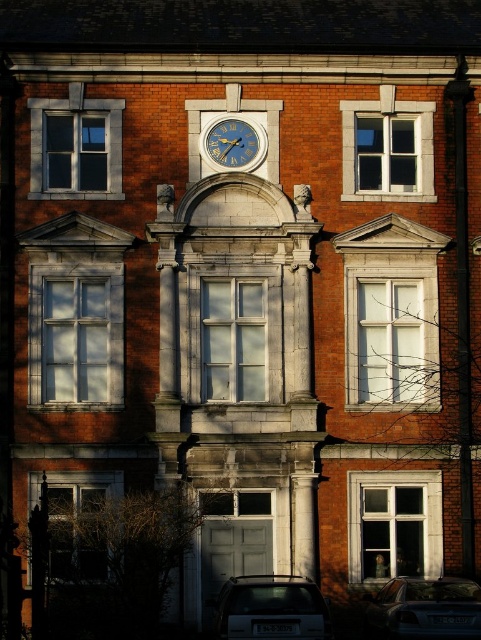
You are a delivery driver approaching the building and need to park your matte silver car at center. The parking spot is directly in front of the white glass window at center. Can you fit your car into the parking spot without overlapping the window?

The white glass window at center is larger in size than the matte silver car at center, so the car can fit into the parking spot without overlapping the window.

Looking at this image, you are an architect reviewing the building facade. You notice the white glass window at center and the blue metallic clock at center. Which object is closer to the viewer?

The white glass window at center is closer to the viewer than the blue metallic clock at center.